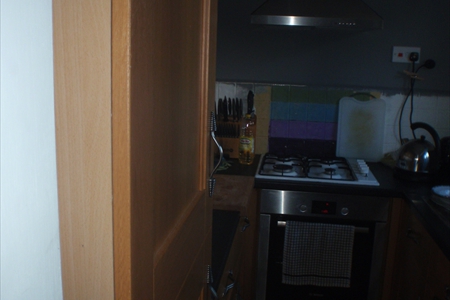
You are a GUI agent. You are given a task and a screenshot of the screen. Output one action in this format:
    pyautogui.click(x=<x>, y=<y>)
    Task: Click on the wooden cabinet
    The width and height of the screenshot is (450, 300).
    Given the screenshot: What is the action you would take?
    pyautogui.click(x=172, y=180)